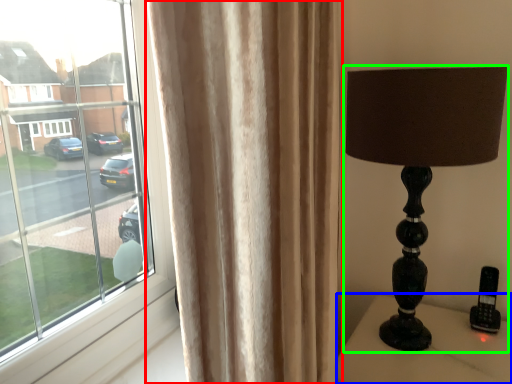
Question: Which object is positioned farthest from curtain (highlighted by a red box)? Select from furniture (highlighted by a blue box) and lamp (highlighted by a green box).

Choices:
 (A) furniture
 (B) lamp

Answer: (A)